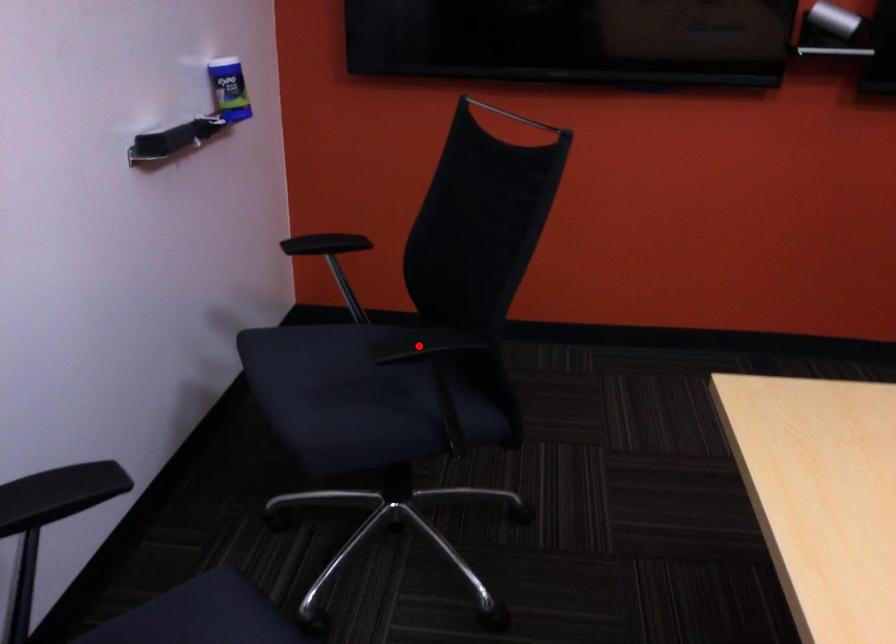
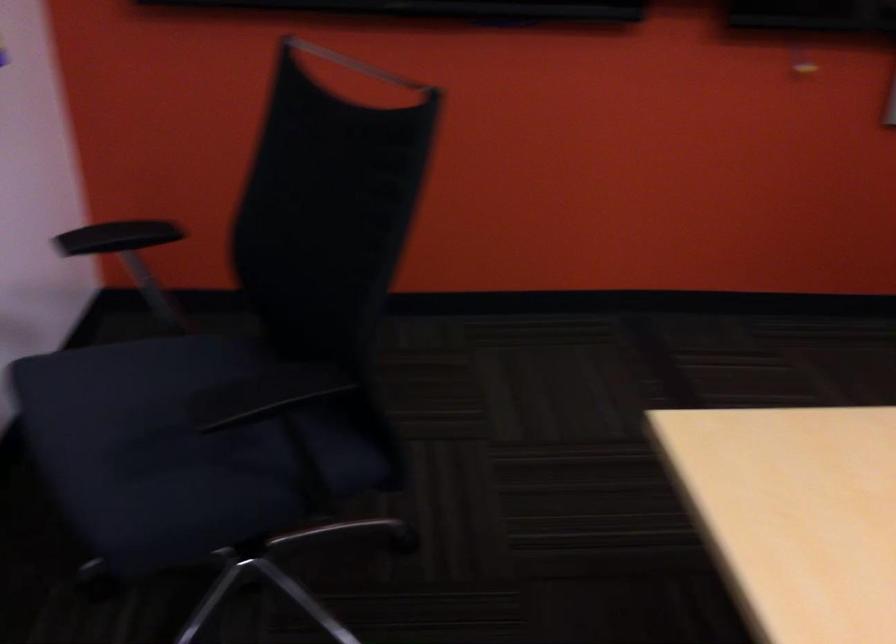
Question: I am providing you with two images of the same scene from different viewpoints. A red point is shown in image1. For the corresponding object point in image2, is it positioned nearer or farther from the camera?

Choices:
 (A) Nearer
 (B) Farther

Answer: (A)